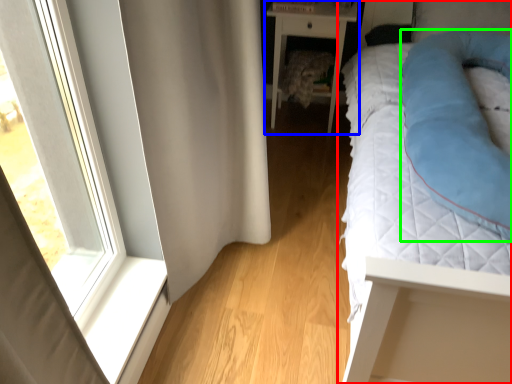
Question: Based on their relative distances, which object is nearer to bed (highlighted by a red box)? Choose from nightstand (highlighted by a blue box) and cat bed (highlighted by a green box).

Choices:
 (A) nightstand
 (B) cat bed

Answer: (B)